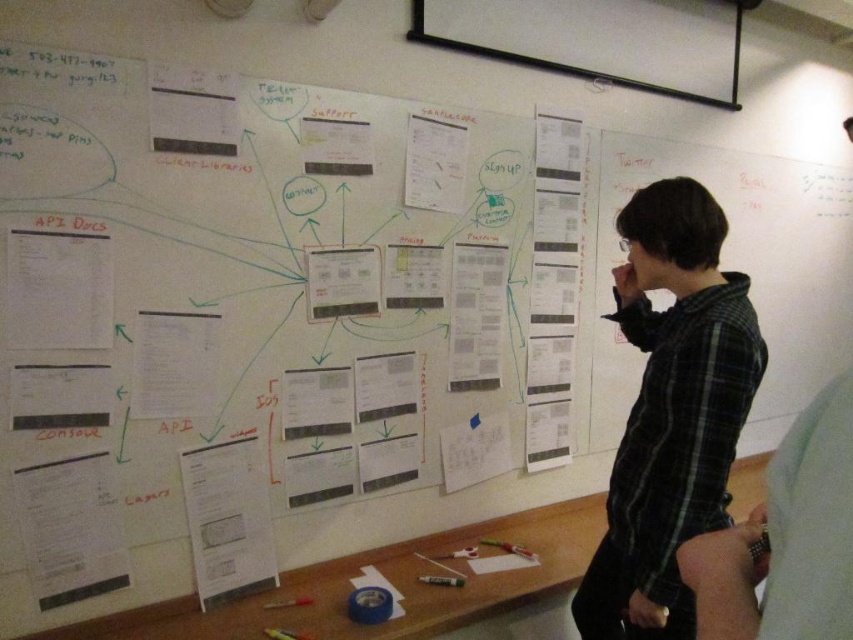
Question: Can you confirm if white paper at upper right is wider than white matte projector screen at upper center?

Choices:
 (A) no
 (B) yes

Answer: (B)

Question: Which of the following is the farthest from the observer?

Choices:
 (A) white paper at upper right
 (B) black plaid shirt at center

Answer: (A)

Question: Is white paper at upper right wider than white matte projector screen at upper center?

Choices:
 (A) yes
 (B) no

Answer: (A)

Question: Does black plaid shirt at center have a larger size compared to white paper at upper right?

Choices:
 (A) no
 (B) yes

Answer: (A)

Question: Which point is farther to the camera?

Choices:
 (A) black plaid shirt at center
 (B) white paper at upper right

Answer: (B)

Question: Based on their relative distances, which object is farther from the white matte projector screen at upper center?

Choices:
 (A) white paper at upper right
 (B) black plaid shirt at center

Answer: (B)